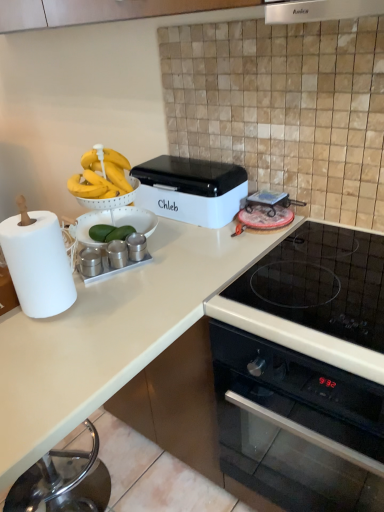
Find the location of `free spot in front of satin silver canisters at center`. free spot in front of satin silver canisters at center is located at coordinates (92, 302).